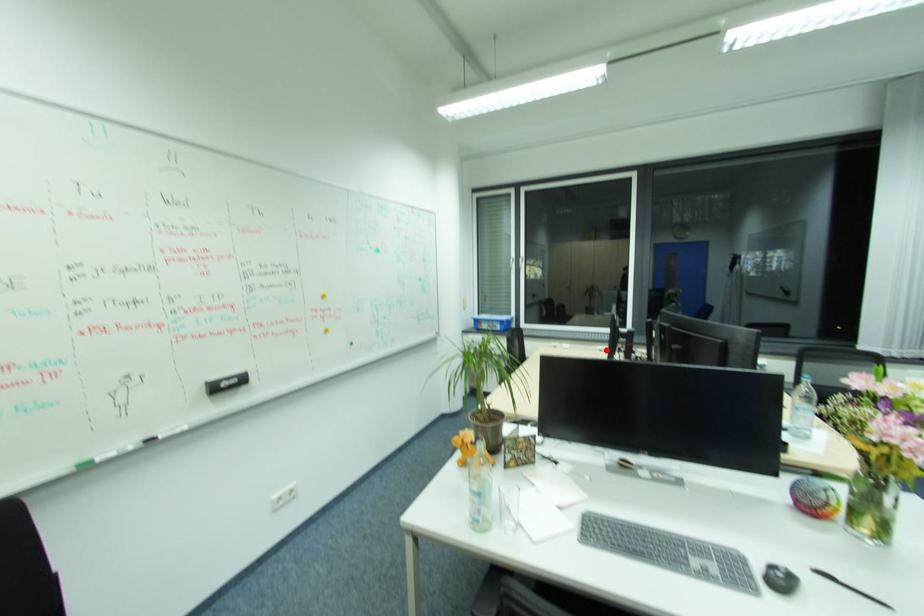
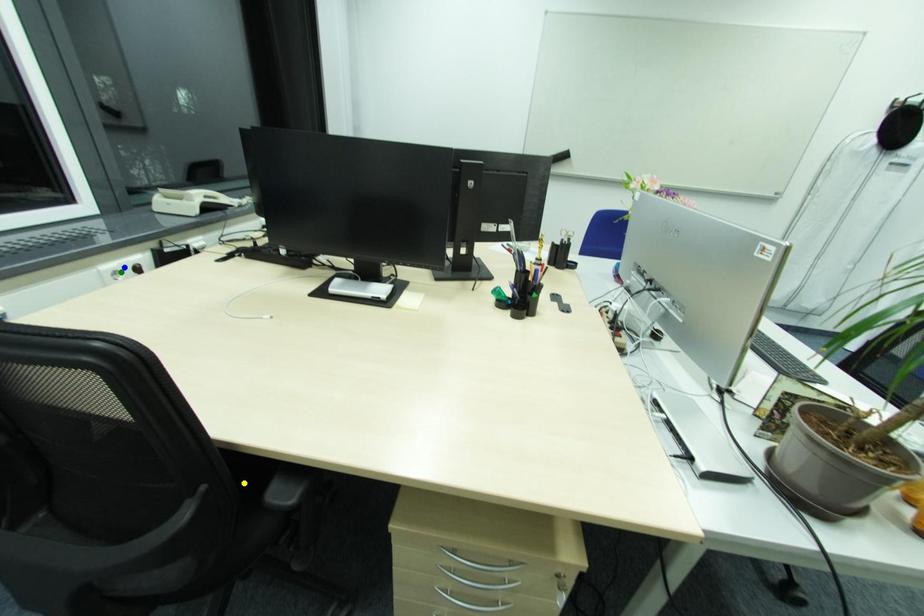
Question: I am providing you with two images of the same scene from different viewpoints. A red point is marked on the first image. You are given multiple points on the second image. Which point in image 2 represents the same 3d spot as the red point in image 1?

Choices:
 (A) blue point
 (B) green point
 (C) yellow point

Answer: (B)